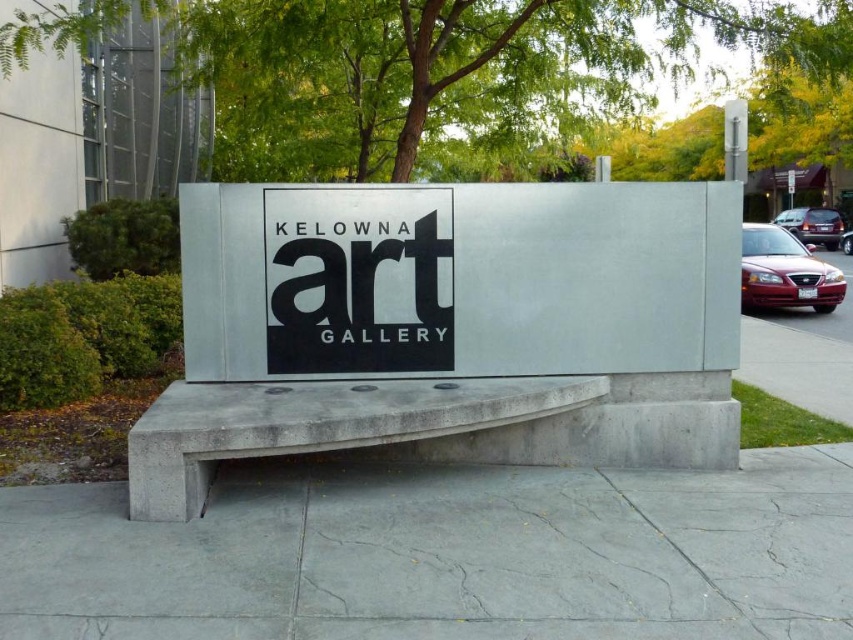
Based on the photo, you are standing in front of the Kelowna Art Gallery sign. Where exactly is the white concrete sign at center located in terms of its 2D coordinates?

The white concrete sign at center is located at the 2D coordinates point (457,278).

You are an artist who wants to place a small sculpture on the white concrete sign at center and the gray concrete bench at center. Which surface do you think can accommodate the sculpture better based on their sizes?

The gray concrete bench at center is larger than the white concrete sign at center, so it can accommodate the sculpture better.